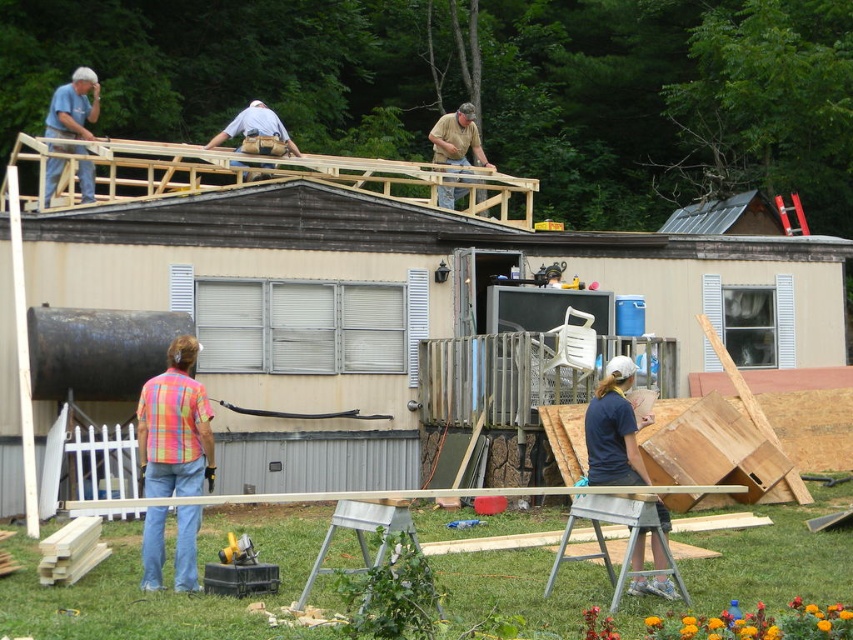
Question: Among these objects, which one is nearest to the camera?

Choices:
 (A) smooth wood plank at lower center
 (B) blue fabric shirt at center
 (C) multicolored plaid shirt at lower left
 (D) light blue denim shirt at upper center

Answer: (A)

Question: Which object is the farthest from the blue fabric shirt at center?

Choices:
 (A) matte brown wood at upper center
 (B) matte blue shirt at upper left

Answer: (A)

Question: Does multicolored plaid shirt at lower left appear on the right side of blue fabric shirt at center?

Choices:
 (A) yes
 (B) no

Answer: (B)

Question: Does smooth wood plank at lower center have a lesser width compared to blue fabric shirt at center?

Choices:
 (A) no
 (B) yes

Answer: (A)

Question: Which of the following is the farthest from the observer?

Choices:
 (A) (198, 400)
 (B) (306, 564)

Answer: (B)

Question: Does smooth wood plank at lower center have a smaller size compared to light blue denim shirt at upper center?

Choices:
 (A) no
 (B) yes

Answer: (B)